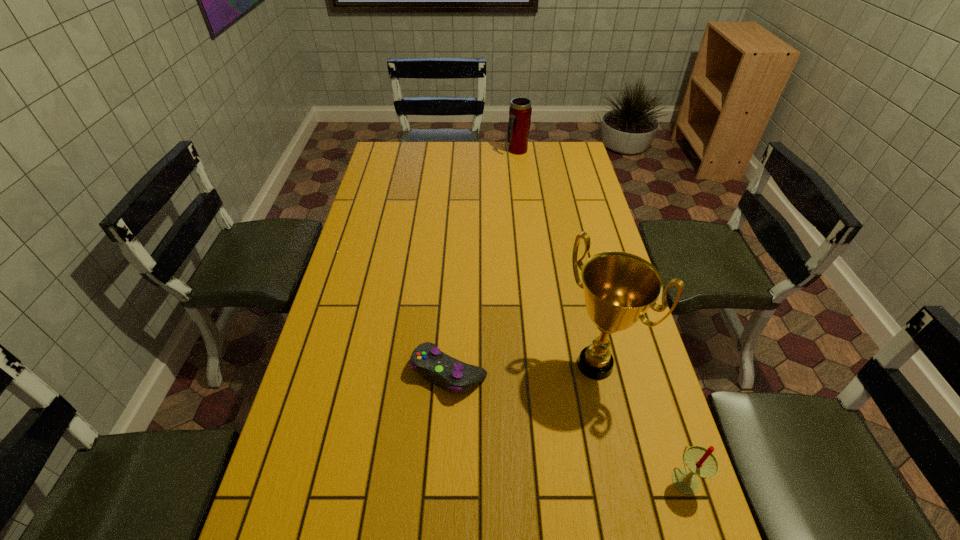
Locate an element on the screen. Image resolution: width=960 pixels, height=540 pixels. the leftmost object is located at coordinates (446, 372).

You are a GUI agent. You are given a task and a screenshot of the screen. Output one action in this format:
    pyautogui.click(x=<x>, y=<y>)
    Task: Click on the shortest object
    The width and height of the screenshot is (960, 540).
    Given the screenshot: What is the action you would take?
    pyautogui.click(x=446, y=372)

You are a GUI agent. You are given a task and a screenshot of the screen. Output one action in this format:
    pyautogui.click(x=<x>, y=<y>)
    Task: Click on the rightmost object
    
    Given the screenshot: What is the action you would take?
    [701, 462]

The height and width of the screenshot is (540, 960). I want to click on candle, so click(x=701, y=462).

At what (x,y) coordinates should I click in order to perform the action: click on the farthest object. Please return your answer as a coordinate pair (x, y). Looking at the image, I should click on (520, 111).

At what (x,y) coordinates should I click in order to perform the action: click on the third shortest object. Please return your answer as a coordinate pair (x, y). Image resolution: width=960 pixels, height=540 pixels. Looking at the image, I should click on (520, 111).

Where is `the tallest object`? This screenshot has height=540, width=960. the tallest object is located at coordinates (619, 287).

Find the location of `vacant space located 0.310m on the right of the shortest object`. vacant space located 0.310m on the right of the shortest object is located at coordinates (605, 372).

You are a GUI agent. You are given a task and a screenshot of the screen. Output one action in this format:
    pyautogui.click(x=<x>, y=<y>)
    Task: Click on the vacant point located on the back of the candle
    This screenshot has height=540, width=960.
    Given the screenshot: What is the action you would take?
    pyautogui.click(x=638, y=333)

Locate an element on the screen. vacant position located 0.110m on the side with the handle of the thermos bottle is located at coordinates (521, 171).